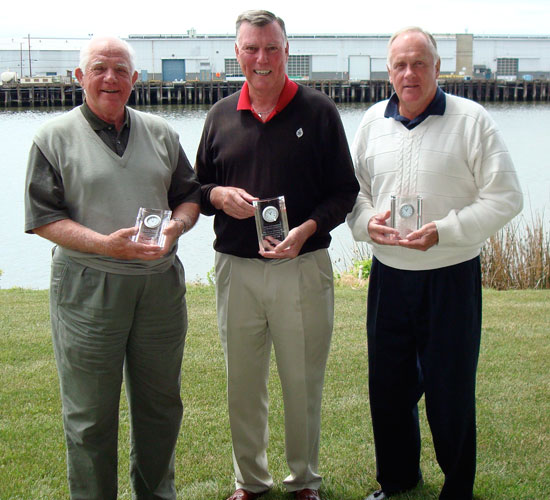
Where is `two pairs of shoes`? two pairs of shoes is located at coordinates (240, 491), (375, 494).